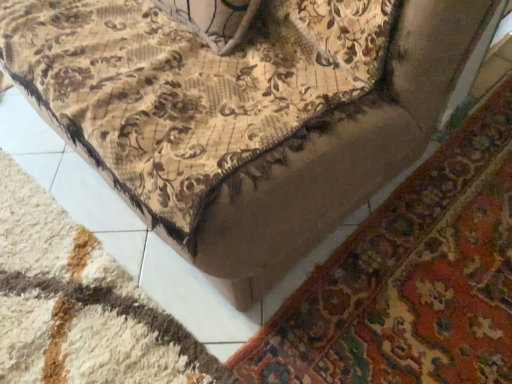
This screenshot has width=512, height=384. I want to click on vacant space underneath floral fabric mat at lower right, which ranks as the first mat in right-to-left order (from a real-world perspective), so click(x=441, y=253).